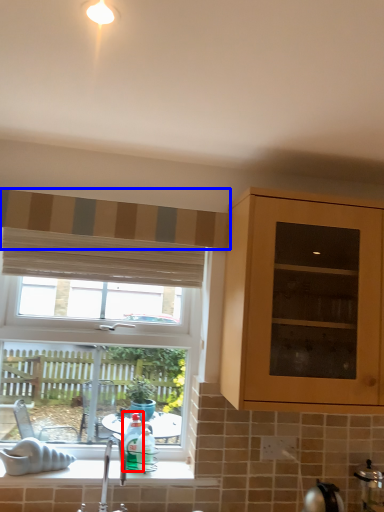
Question: Which point is closer to the camera, bottle (highlighted by a red box) or curtain (highlighted by a blue box)?

Choices:
 (A) bottle
 (B) curtain

Answer: (B)